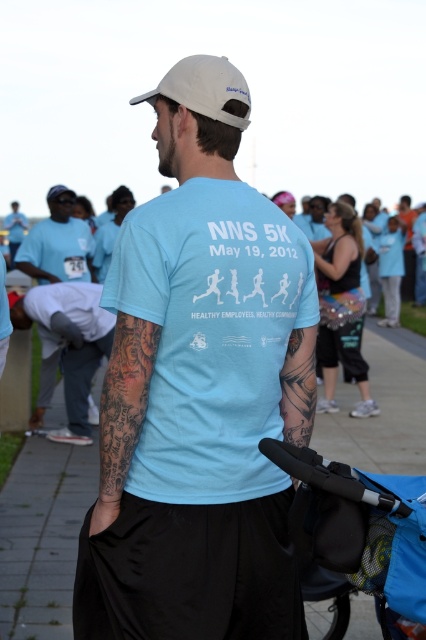
Can you confirm if light gray concrete pavement at center is shorter than blue fabric stroller at lower right?

Incorrect, light gray concrete pavement at center's height does not fall short of blue fabric stroller at lower right's.

Who is more forward, (417, 349) or (379, 600)?

Point (379, 600) is in front.

Measure the distance between point (391, 467) and camera.

23.09 feet

Find the location of a particular element. light gray concrete pavement at center is located at coordinates (43, 536).

Consider the image. Is light gray concrete pavement at center wider than gray fabric pants at lower left?

Indeed, light gray concrete pavement at center has a greater width compared to gray fabric pants at lower left.

Between light gray concrete pavement at center and gray fabric pants at lower left, which one is positioned lower?

light gray concrete pavement at center

Find the location of a particular element. light gray concrete pavement at center is located at coordinates click(x=43, y=536).

Identify the location of light gray concrete pavement at center. The image size is (426, 640). (43, 536).

Identify the location of light blue t-shirt at center. (199, 392).

Consider the image. Is light blue t-shirt at center bigger than light gray concrete pavement at center?

No, light blue t-shirt at center is not bigger than light gray concrete pavement at center.

Describe the element at coordinates (199, 392) in the screenshot. I see `light blue t-shirt at center` at that location.

Locate an element on the screen. Image resolution: width=426 pixels, height=640 pixels. light blue t-shirt at center is located at coordinates (199, 392).